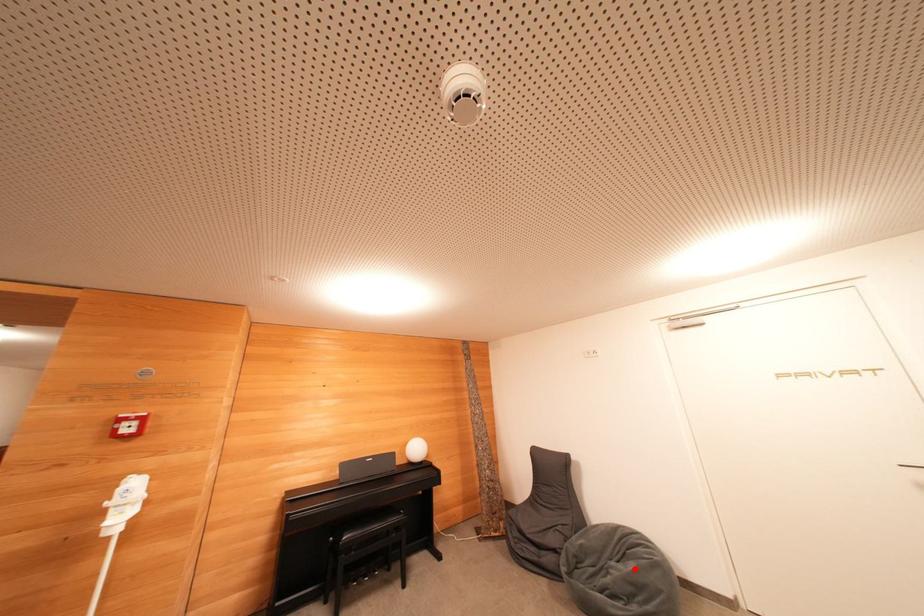
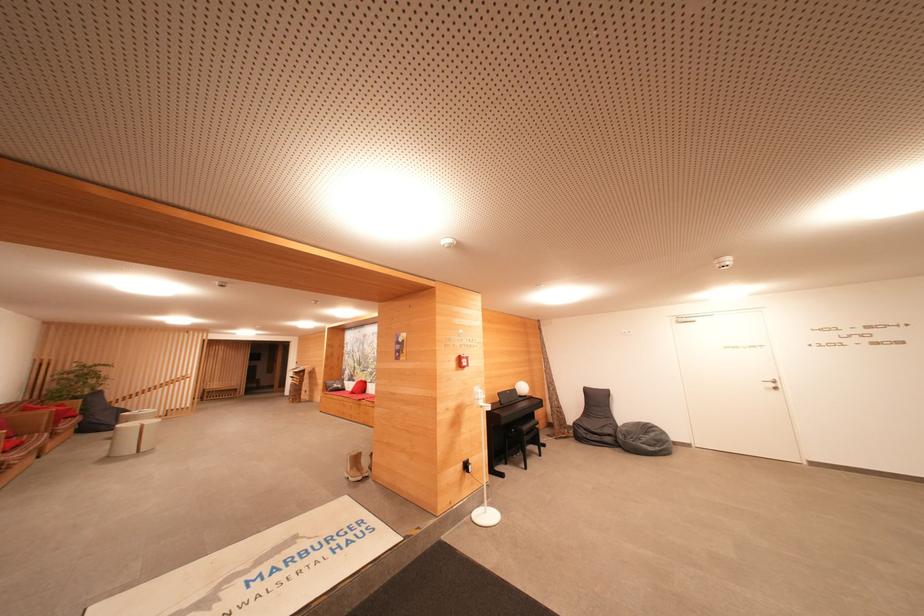
Where in the second image is the point corresponding to the highlighted location from the first image?

(655, 438)